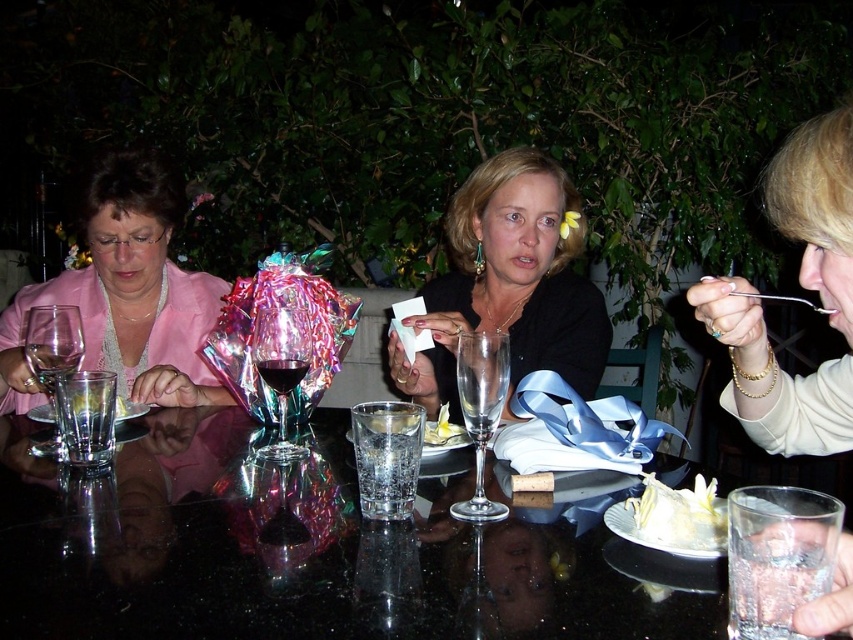
Question: Considering the relative positions of matte black dress at center and ruby glass at center in the image provided, where is matte black dress at center located with respect to ruby glass at center?

Choices:
 (A) above
 (B) below

Answer: (A)

Question: Can you confirm if clear glass water at center is thinner than dark red liquid at center?

Choices:
 (A) no
 (B) yes

Answer: (A)

Question: From the image, what is the correct spatial relationship of gold bracelet at upper right in relation to clear glass wine at center?

Choices:
 (A) above
 (B) below

Answer: (A)

Question: Which object is positioned closest to the dark red liquid at center?

Choices:
 (A) matte black dress at center
 (B) ruby glass at center
 (C) matte pink jacket at left
 (D) transparent glass table at center

Answer: (B)

Question: Which point is closer to the camera?

Choices:
 (A) (469, 403)
 (B) (264, 380)
 (C) (125, 410)

Answer: (A)

Question: Which is farther from the matte black dress at center?

Choices:
 (A) clear glass water at center
 (B) transparent glass table at center
 (C) ruby glass at center

Answer: (A)